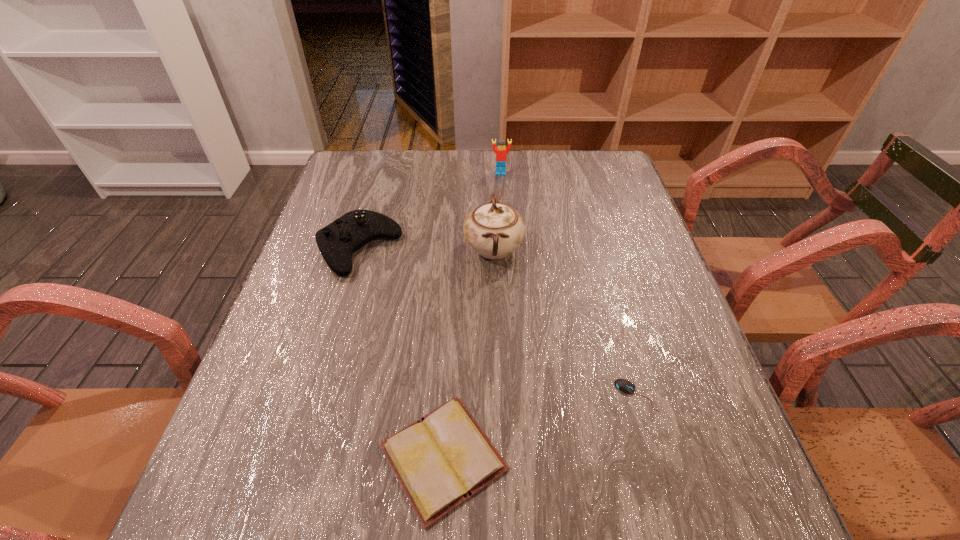
This screenshot has height=540, width=960. In order to click on empty space between the third shortest object and the chinaware in this screenshot , I will do click(x=426, y=249).

Locate an element on the screen. The width and height of the screenshot is (960, 540). free space between the tallest object and the second shortest object is located at coordinates (468, 353).

This screenshot has height=540, width=960. In order to click on vacant area that lies between the third shortest object and the fourth shortest object in this screenshot , I will do `click(430, 211)`.

Locate an element on the screen. the third closest object relative to the shortest object is located at coordinates pos(337,242).

Find the location of a particular element. The width and height of the screenshot is (960, 540). object that stands as the second closest to the control is located at coordinates (443, 459).

Identify the location of vacant position in the image that satisfies the following two spatial constraints: 1. on the face of the mouse; 2. on the left side of the farthest object. (515, 395).

This screenshot has height=540, width=960. Find the location of `vacant area that satisfies the following two spatial constraints: 1. on the face of the farthest object; 2. on the right side of the rightmost object`. vacant area that satisfies the following two spatial constraints: 1. on the face of the farthest object; 2. on the right side of the rightmost object is located at coordinates (515, 395).

Where is `free space that satisfies the following two spatial constraints: 1. on the face of the rightmost object; 2. on the left side of the fourth shortest object`? free space that satisfies the following two spatial constraints: 1. on the face of the rightmost object; 2. on the left side of the fourth shortest object is located at coordinates (515, 395).

Where is `free space that satisfies the following two spatial constraints: 1. on the face of the second tallest object; 2. on the right side of the mouse`? free space that satisfies the following two spatial constraints: 1. on the face of the second tallest object; 2. on the right side of the mouse is located at coordinates (515, 395).